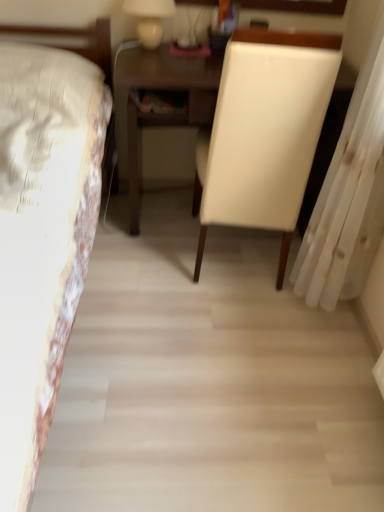
I want to click on free space in front of matte white lamp at upper center, so click(152, 63).